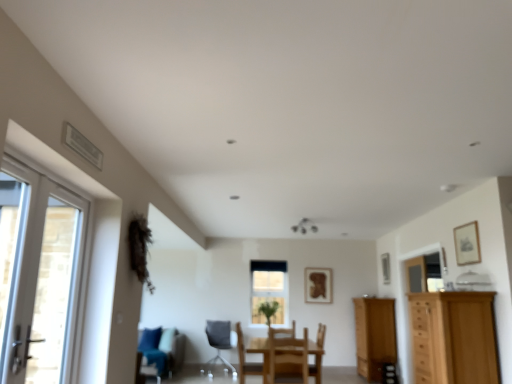
Question: Considering the relative sizes of wooden picture frame at right, positioned as the 1th picture frame in right-to-left order, and light brown wooden cabinet at right, placed as the 1th cabinetry when sorted from front to back, in the image provided, is wooden picture frame at right, positioned as the 1th picture frame in right-to-left order, taller than light brown wooden cabinet at right, placed as the 1th cabinetry when sorted from front to back,?

Choices:
 (A) no
 (B) yes

Answer: (A)

Question: From the image's perspective, would you say wooden picture frame at right, the 3th picture frame from the left, is shown under light brown wooden cabinet at right, the second cabinetry from the bottom?

Choices:
 (A) no
 (B) yes

Answer: (A)

Question: From the image's perspective, does wooden picture frame at right, the second picture frame in the top-to-bottom sequence, appear higher than light brown wooden cabinet at right, marked as the 1th cabinetry in a top-to-bottom arrangement?

Choices:
 (A) yes
 (B) no

Answer: (A)

Question: Considering the relative positions of wooden picture frame at right, positioned as the second picture frame in back-to-front order, and light brown wooden cabinet at right, marked as the 1th cabinetry in a top-to-bottom arrangement, in the image provided, is wooden picture frame at right, positioned as the second picture frame in back-to-front order, to the left of light brown wooden cabinet at right, marked as the 1th cabinetry in a top-to-bottom arrangement, from the viewer's perspective?

Choices:
 (A) yes
 (B) no

Answer: (B)

Question: Is wooden picture frame at right, positioned as the second picture frame in back-to-front order, positioned in front of light brown wooden cabinet at right, placed as the 1th cabinetry when sorted from front to back?

Choices:
 (A) no
 (B) yes

Answer: (A)

Question: Considering the relative sizes of wooden picture frame at right, positioned as the second picture frame in back-to-front order, and light brown wooden cabinet at right, the second cabinetry from the bottom, in the image provided, is wooden picture frame at right, positioned as the second picture frame in back-to-front order, shorter than light brown wooden cabinet at right, the second cabinetry from the bottom,?

Choices:
 (A) no
 (B) yes

Answer: (B)

Question: Considering the relative positions of light brown wood cabinet at right, the second cabinetry viewed from the front, and wooden picture frame at right, positioned as the second picture frame in back-to-front order, in the image provided, is light brown wood cabinet at right, the second cabinetry viewed from the front, to the left of wooden picture frame at right, positioned as the second picture frame in back-to-front order, from the viewer's perspective?

Choices:
 (A) yes
 (B) no

Answer: (A)

Question: Is light brown wood cabinet at right, acting as the 1th cabinetry starting from the bottom, not near wooden picture frame at right, the second picture frame in the top-to-bottom sequence?

Choices:
 (A) yes
 (B) no

Answer: (B)

Question: Could you tell me if light brown wood cabinet at right, which appears as the second cabinetry when viewed from the top, is facing wooden picture frame at right, positioned as the second picture frame in back-to-front order?

Choices:
 (A) yes
 (B) no

Answer: (B)

Question: From the image's perspective, is light brown wood cabinet at right, the second cabinetry viewed from the front, located beneath wooden picture frame at right, which is the 2th picture frame in front-to-back order?

Choices:
 (A) no
 (B) yes

Answer: (B)

Question: Is the position of light brown wood cabinet at right, which appears as the second cabinetry when viewed from the top, less distant than that of wooden picture frame at right, positioned as the second picture frame in back-to-front order?

Choices:
 (A) no
 (B) yes

Answer: (B)

Question: Is light brown wood cabinet at right, acting as the 1th cabinetry starting from the bottom, shorter than wooden picture frame at right, the 3th picture frame from the left?

Choices:
 (A) no
 (B) yes

Answer: (A)

Question: Can you confirm if clear glass window at center is thinner than wooden framed picture at center, the 3th picture frame positioned from the top?

Choices:
 (A) yes
 (B) no

Answer: (B)